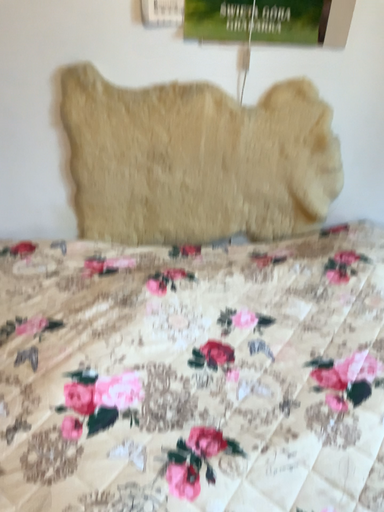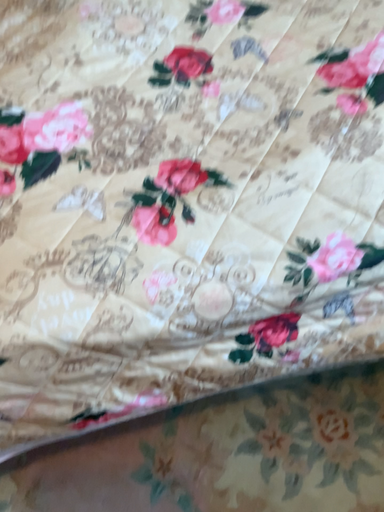
Question: How did the camera likely rotate when shooting the video?

Choices:
 (A) rotated upward
 (B) rotated downward

Answer: (B)